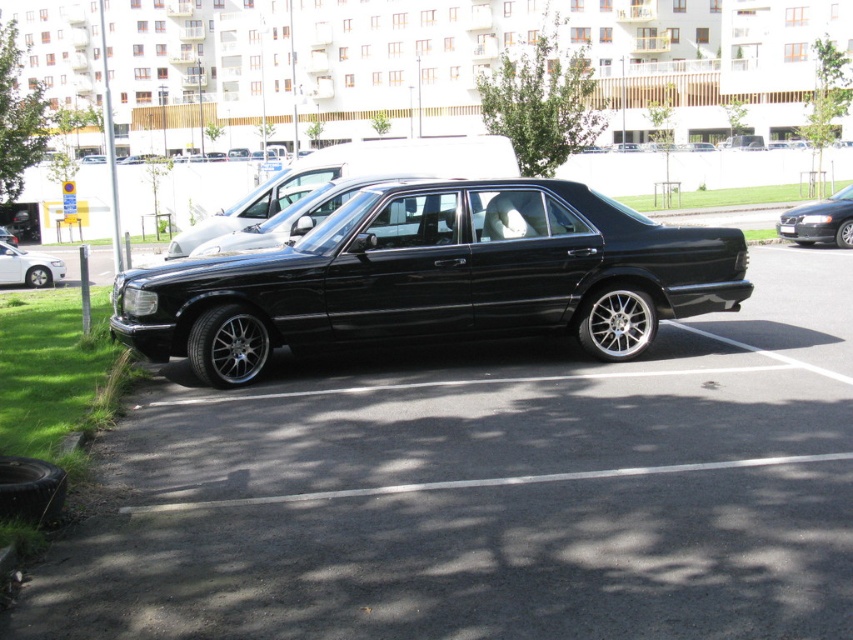
Looking at this image, does black car at center appear under matte black sedan at left?

Correct, black car at center is located below matte black sedan at left.

At what (x,y) coordinates should I click in order to perform the action: click on black car at center. Please return your answer as a coordinate pair (x, y). Image resolution: width=853 pixels, height=640 pixels. Looking at the image, I should click on tap(488, 490).

This screenshot has height=640, width=853. In order to click on black car at center in this screenshot , I will do `click(488, 490)`.

Is black polished sedan at center closer to camera compared to black metallic sedan at right?

Yes, black polished sedan at center is in front of black metallic sedan at right.

From the picture: Can you confirm if black polished sedan at center is wider than black metallic sedan at right?

Indeed, black polished sedan at center has a greater width compared to black metallic sedan at right.

Is point (421, 280) farther from camera compared to point (798, 230)?

No, (421, 280) is in front of (798, 230).

Where is `black polished sedan at center`? This screenshot has width=853, height=640. black polished sedan at center is located at coordinates (436, 276).

Who is positioned more to the left, black car at center or black metallic sedan at center?

Positioned to the left is black metallic sedan at center.

The height and width of the screenshot is (640, 853). I want to click on black car at center, so click(x=488, y=490).